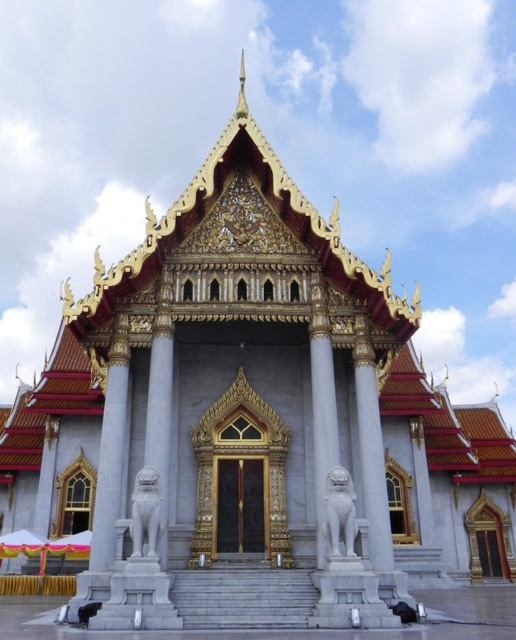
Question: Which object is farther from the camera taking this photo?

Choices:
 (A) white marble lion at center
 (B) white marble lion at lower center

Answer: (A)

Question: Is white marble lion at center thinner than white marble lion at lower center?

Choices:
 (A) no
 (B) yes

Answer: (B)

Question: Where is white marble lion at center located in relation to white marble lion at lower center in the image?

Choices:
 (A) left
 (B) right

Answer: (B)

Question: Can you confirm if white marble lion at center is smaller than white marble lion at lower center?

Choices:
 (A) yes
 (B) no

Answer: (A)